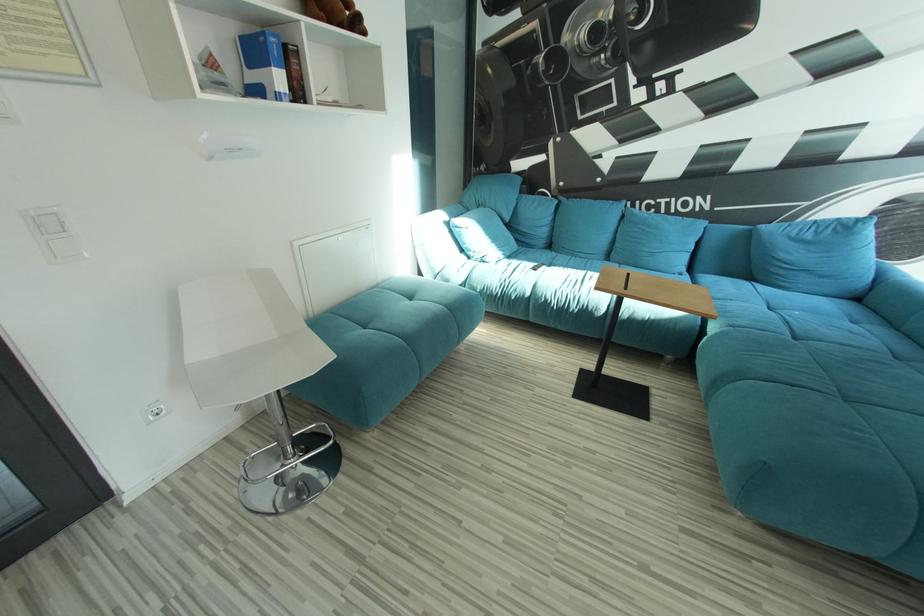
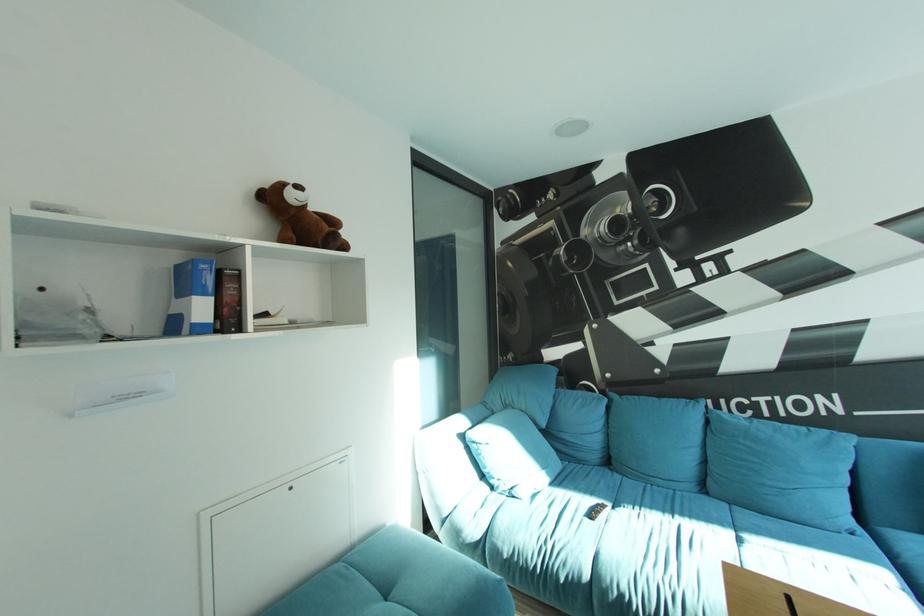
Question: Based on the continuous images, in which direction is the camera rotating? Reply with the corresponding letter.

Choices:
 (A) Left
 (B) Right
 (C) Up
 (D) Down

Answer: (C)